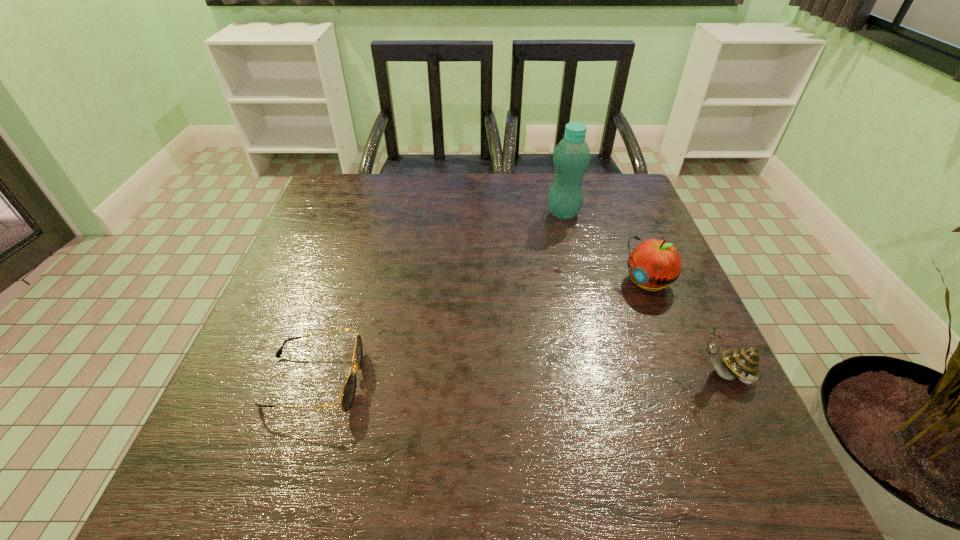
The height and width of the screenshot is (540, 960). Find the location of `free space on the desktop that is between the shortest object and the snail and is positioned at the front cap of the tallest object`. free space on the desktop that is between the shortest object and the snail and is positioned at the front cap of the tallest object is located at coordinates (473, 379).

Locate an element on the screen. free space on the desktop that is between the shortest object and the snail and is positioned on the surface of the apple is located at coordinates (518, 378).